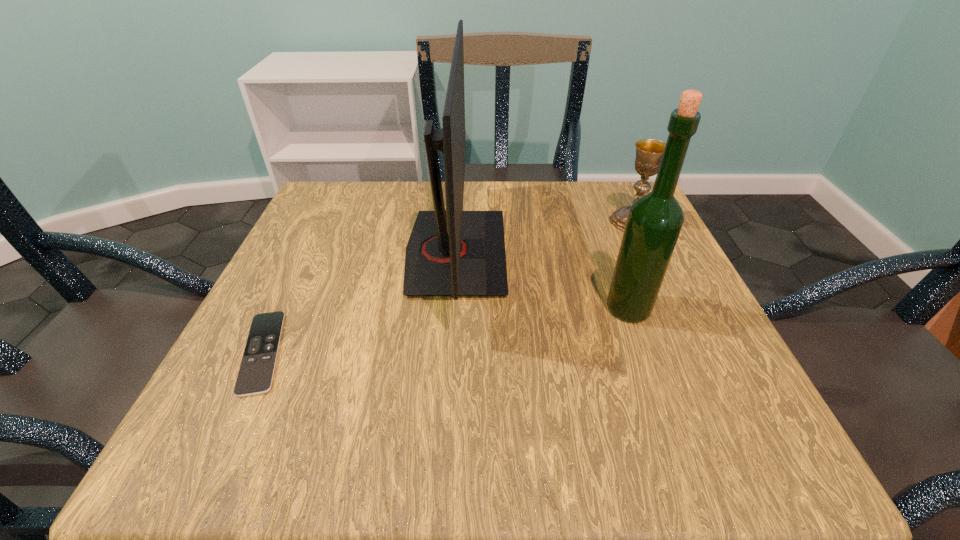
At what (x,y) coordinates should I click in order to perform the action: click on the second object from left to right. Please return your answer as a coordinate pair (x, y). The image size is (960, 540). Looking at the image, I should click on (451, 252).

The image size is (960, 540). I want to click on liquor, so click(x=654, y=222).

Locate an element on the screen. the second shortest object is located at coordinates (649, 152).

Locate an element on the screen. The image size is (960, 540). remote control is located at coordinates (255, 376).

You are a GUI agent. You are given a task and a screenshot of the screen. Output one action in this format:
    pyautogui.click(x=<x>, y=<y>)
    Task: Click on the leftmost object
    
    Given the screenshot: What is the action you would take?
    255,376

Locate an element on the screen. The image size is (960, 540). vacant point located 0.270m on the screen side of the third object from right to left is located at coordinates (639, 253).

The width and height of the screenshot is (960, 540). I want to click on free location located 0.140m on the left of the liquor, so [x=526, y=308].

The width and height of the screenshot is (960, 540). Find the location of `vacant space located 0.050m on the back of the second shortest object`. vacant space located 0.050m on the back of the second shortest object is located at coordinates (622, 197).

Find the location of a particular element. vacant space located 0.390m on the back of the shortest object is located at coordinates (336, 197).

Find the location of `monitor present at the far edge`. monitor present at the far edge is located at coordinates (451, 252).